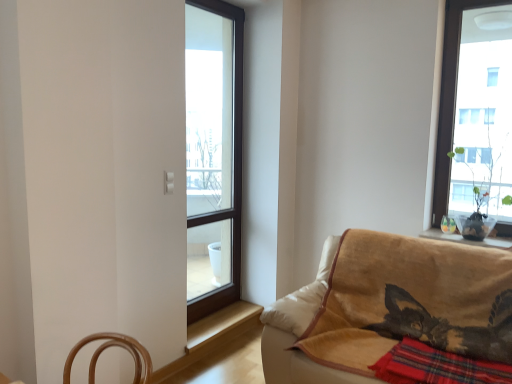
Question: Looking at the image, does wooden at lower center seem bigger or smaller compared to velvet beige couch at lower right?

Choices:
 (A) big
 (B) small

Answer: (B)

Question: Is wooden at lower center in front of or behind velvet beige couch at lower right in the image?

Choices:
 (A) front
 (B) behind

Answer: (B)

Question: Which object is the farthest from the red plaid blanket at lower right?

Choices:
 (A) transparent glass window at center
 (B) wooden at lower center
 (C) velvet beige couch at lower right

Answer: (A)

Question: Which is farther from the red plaid blanket at lower right?

Choices:
 (A) transparent glass window at center
 (B) velvet beige couch at lower right
 (C) wooden at lower center

Answer: (A)